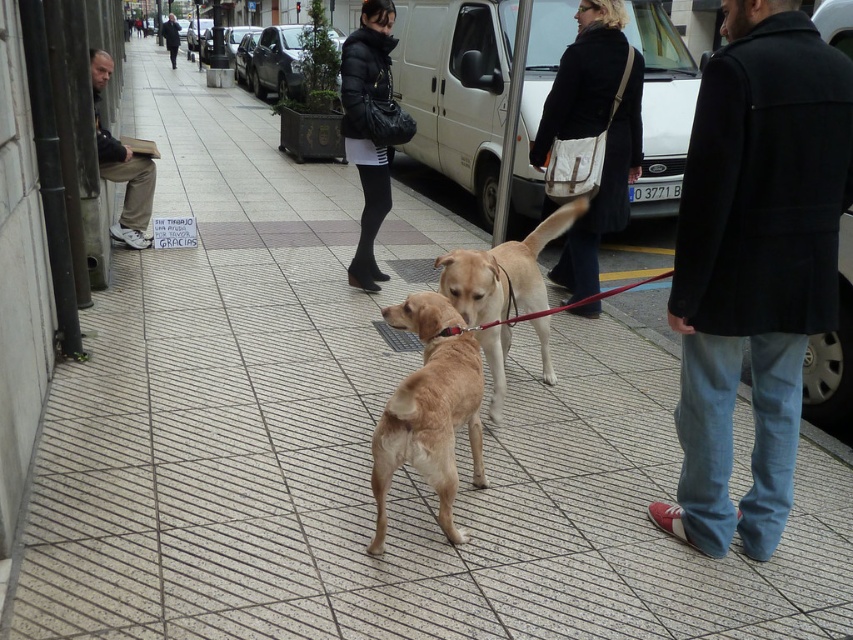
Who is positioned more to the right, dark blue wool coat at center or light brown fur at center?

Positioned to the right is dark blue wool coat at center.

Can you confirm if dark blue wool coat at center is positioned above light brown fur at center?

No, dark blue wool coat at center is not above light brown fur at center.

Between point (708, 385) and point (496, 291), which one is positioned behind?

Point (496, 291)

Image resolution: width=853 pixels, height=640 pixels. Find the location of `dark blue wool coat at center`. dark blue wool coat at center is located at coordinates (753, 262).

Which of these two, dark blue wool coat at center or matte black jacket at center, stands shorter?

Standing shorter between the two is dark blue wool coat at center.

Who is lower down, dark blue wool coat at center or matte black jacket at center?

dark blue wool coat at center

Who is more forward, (712, 502) or (354, 52)?

Point (712, 502)

Where is `dark blue wool coat at center`? dark blue wool coat at center is located at coordinates (753, 262).

The image size is (853, 640). Find the location of `golden fur dog at center`. golden fur dog at center is located at coordinates (428, 412).

Does golden fur dog at center have a greater height compared to matte black jacket at center?

In fact, golden fur dog at center may be shorter than matte black jacket at center.

What do you see at coordinates (428, 412) in the screenshot?
I see `golden fur dog at center` at bounding box center [428, 412].

This screenshot has width=853, height=640. Identify the location of golden fur dog at center. (428, 412).